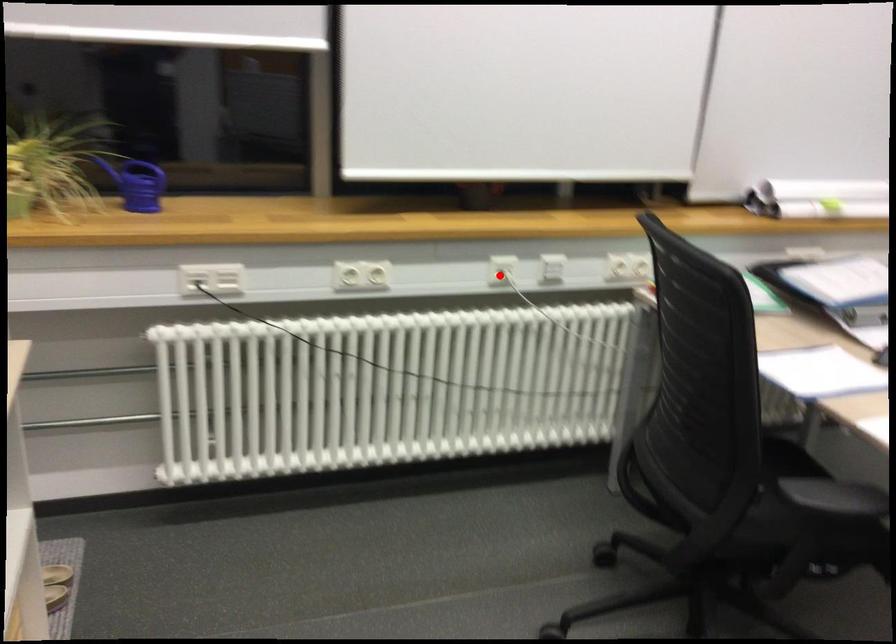
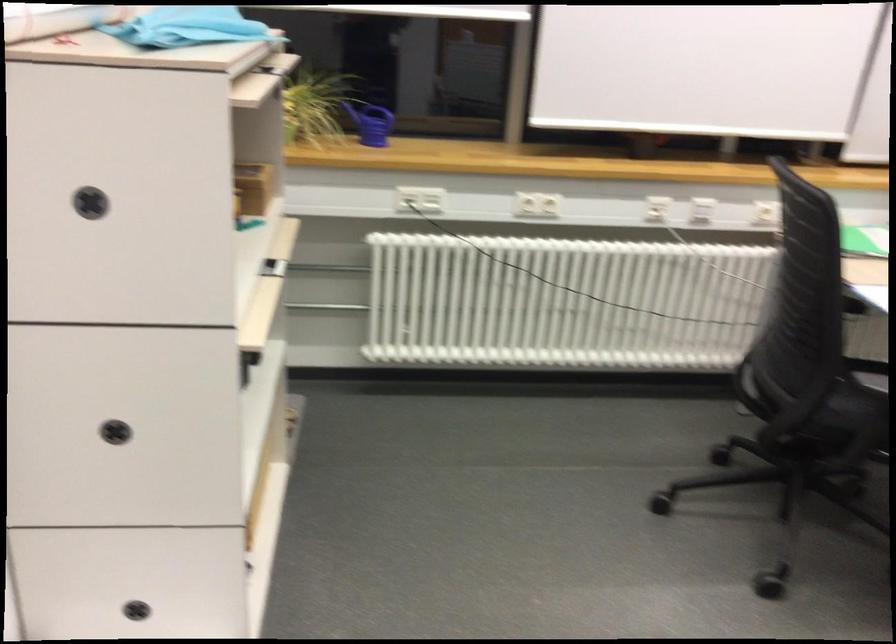
Question: I am providing you with two images of the same scene from different viewpoints. In image1, a red point is highlighted. Considering the same 3D point in image2, which of the following is correct?

Choices:
 (A) It is closer
 (B) It is farther

Answer: (B)